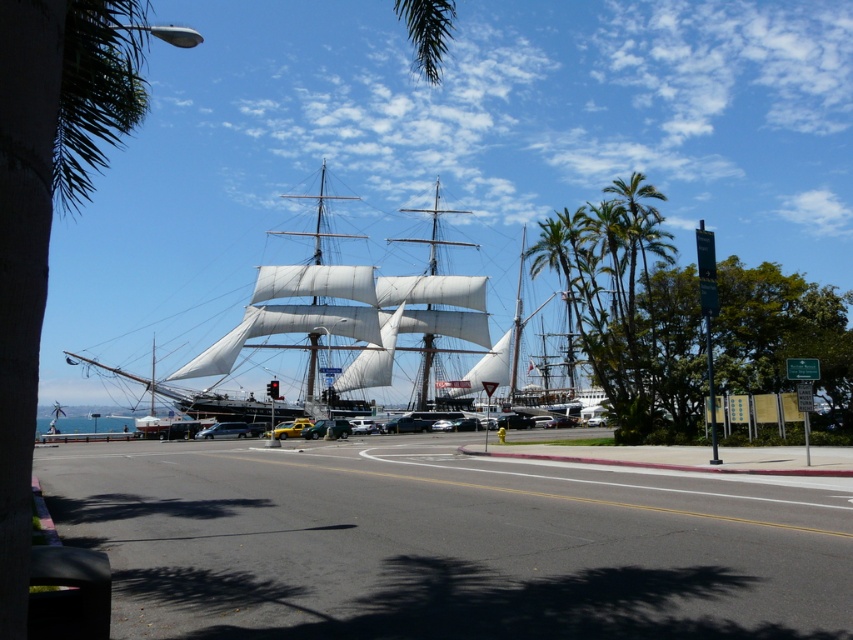
Between green leafy palm tree at center-right and metallic silver car at center, which one has less height?

metallic silver car at center is shorter.

Does green leafy palm tree at center-right have a greater height compared to metallic silver car at center?

Yes, green leafy palm tree at center-right is taller than metallic silver car at center.

Is point (548, 264) positioned in front of point (239, 432)?

Yes, point (548, 264) is in front of point (239, 432).

I want to click on green leafy palm tree at center-right, so [556, 275].

Does white canvas sailboat at center have a lesser height compared to metallic silver car at center?

In fact, white canvas sailboat at center may be taller than metallic silver car at center.

Is white canvas sailboat at center smaller than metallic silver car at center?

No.

At what (x,y) coordinates should I click in order to perform the action: click on white canvas sailboat at center. Please return your answer as a coordinate pair (x, y). The image size is (853, 640). Looking at the image, I should click on (363, 314).

Locate an element on the screen. The width and height of the screenshot is (853, 640). white canvas sailboat at center is located at coordinates (363, 314).

Does point (570, 340) come farther from viewer compared to point (515, 291)?

No, it is in front of (515, 291).

Locate an element on the screen. green leafy palm tree at center-right is located at coordinates (556, 275).